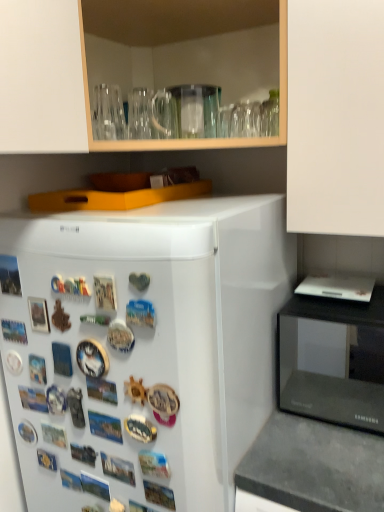
What are the coordinates of `transparent glass cabinet at upper center` in the screenshot? It's located at (73, 83).

The width and height of the screenshot is (384, 512). What do you see at coordinates (142, 349) in the screenshot? I see `white glossy refrigerator at left` at bounding box center [142, 349].

Identify the location of black glossy microwave at right. Image resolution: width=384 pixels, height=512 pixels. (333, 360).

The image size is (384, 512). Find the location of `counter top that appears on the right of transparent glass cabinet at upper center`. counter top that appears on the right of transparent glass cabinet at upper center is located at coordinates (314, 466).

Is dark gray concrete counter top at lower right beside transparent glass cabinet at upper center?

dark gray concrete counter top at lower right and transparent glass cabinet at upper center are not in contact.

Which of these two, dark gray concrete counter top at lower right or transparent glass cabinet at upper center, is thinner?

A: dark gray concrete counter top at lower right is thinner.

From the image's perspective, which is above, dark gray concrete counter top at lower right or transparent glass cabinet at upper center?

transparent glass cabinet at upper center.

How different are the orientations of dark gray concrete counter top at lower right and white glossy refrigerator at left in degrees?

There is a 1.14-degree angle between the facing directions of dark gray concrete counter top at lower right and white glossy refrigerator at left.

How far apart are dark gray concrete counter top at lower right and white glossy refrigerator at left?

dark gray concrete counter top at lower right and white glossy refrigerator at left are 12.49 inches apart.

Looking at this image, which of these two, dark gray concrete counter top at lower right or white glossy refrigerator at left, is bigger?

Bigger between the two is white glossy refrigerator at left.

This screenshot has height=512, width=384. Identify the location of counter top behind the white glossy refrigerator at left. (314, 466).

Is black glossy microwave at right oriented towards dark gray concrete counter top at lower right?

No.

Where is `appliance behind the dark gray concrete counter top at lower right`? This screenshot has width=384, height=512. appliance behind the dark gray concrete counter top at lower right is located at coordinates (333, 360).

Does black glossy microwave at right appear on the left side of dark gray concrete counter top at lower right?

No, black glossy microwave at right is not to the left of dark gray concrete counter top at lower right.

Which object is more forward, black glossy microwave at right or dark gray concrete counter top at lower right?

Positioned in front is dark gray concrete counter top at lower right.

Based on the photo, which point is more distant from viewer, (37, 21) or (186, 405)?

Point (186, 405)

Is transparent glass cabinet at upper center surrounding white glossy refrigerator at left?

No, white glossy refrigerator at left is located outside of transparent glass cabinet at upper center.

Is transparent glass cabinet at upper center next to white glossy refrigerator at left and touching it?

No, transparent glass cabinet at upper center is not touching white glossy refrigerator at left.

Can black glossy microwave at right be found inside dark gray concrete counter top at lower right?

Actually, black glossy microwave at right is outside dark gray concrete counter top at lower right.

Relative to black glossy microwave at right, is dark gray concrete counter top at lower right in front or behind?

In the image, dark gray concrete counter top at lower right appears in front of black glossy microwave at right.

Is dark gray concrete counter top at lower right taller or shorter than black glossy microwave at right?

dark gray concrete counter top at lower right is taller than black glossy microwave at right.

From a real-world perspective, is dark gray concrete counter top at lower right located higher than black glossy microwave at right?

No, from a real-world perspective, dark gray concrete counter top at lower right is not over black glossy microwave at right

Consider the image. Is transparent glass cabinet at upper center behind dark gray concrete counter top at lower right?

Yes, transparent glass cabinet at upper center is behind dark gray concrete counter top at lower right.

From their relative heights in the image, would you say transparent glass cabinet at upper center is taller or shorter than dark gray concrete counter top at lower right?

Considering their sizes, transparent glass cabinet at upper center has less height than dark gray concrete counter top at lower right.

Is transparent glass cabinet at upper center positioned far away from dark gray concrete counter top at lower right?

No.

Which of these two, transparent glass cabinet at upper center or dark gray concrete counter top at lower right, is bigger?

With larger size is transparent glass cabinet at upper center.

Which object is further away from the camera, black glossy microwave at right or white glossy refrigerator at left?

black glossy microwave at right.

Does point (321, 306) appear closer or farther from the camera than point (226, 319)?

Point (321, 306) is positioned farther from the camera compared to point (226, 319).

Locate an element on the screen. The image size is (384, 512). refrigerator located underneath the black glossy microwave at right (from a real-world perspective) is located at coordinates (142, 349).

Which object is positioned more to the right, black glossy microwave at right or white glossy refrigerator at left?

black glossy microwave at right is more to the right.

This screenshot has width=384, height=512. Find the location of `counter top located in front of the transparent glass cabinet at upper center`. counter top located in front of the transparent glass cabinet at upper center is located at coordinates (314, 466).

In the image, there is a white glossy refrigerator at left. Find the location of `counter top below it (from a real-world perspective)`. counter top below it (from a real-world perspective) is located at coordinates (314, 466).

Which object lies nearer to the anchor point black glossy microwave at right, white glossy refrigerator at left or transparent glass cabinet at upper center?

white glossy refrigerator at left.

Looking at the image, which one is located closer to dark gray concrete counter top at lower right, black glossy microwave at right or white glossy refrigerator at left?

white glossy refrigerator at left is closer to dark gray concrete counter top at lower right.

Considering their positions, is dark gray concrete counter top at lower right positioned closer to transparent glass cabinet at upper center than white glossy refrigerator at left?

white glossy refrigerator at left lies closer to transparent glass cabinet at upper center than the other object.

From the image, which object appears to be farther from black glossy microwave at right, white glossy refrigerator at left or dark gray concrete counter top at lower right?

white glossy refrigerator at left lies further to black glossy microwave at right than the other object.

From the image, which object appears to be nearer to dark gray concrete counter top at lower right, white glossy refrigerator at left or transparent glass cabinet at upper center?

white glossy refrigerator at left is positioned closer to the anchor dark gray concrete counter top at lower right.

Estimate the real-world distances between objects in this image. Which object is further from transparent glass cabinet at upper center, white glossy refrigerator at left or dark gray concrete counter top at lower right?

dark gray concrete counter top at lower right lies further to transparent glass cabinet at upper center than the other object.

When comparing their distances from black glossy microwave at right, does transparent glass cabinet at upper center or white glossy refrigerator at left seem closer?

white glossy refrigerator at left is positioned closer to the anchor black glossy microwave at right.

Based on the photo, from the image, which object appears to be farther from transparent glass cabinet at upper center, white glossy refrigerator at left or black glossy microwave at right?

Based on the image, black glossy microwave at right appears to be further to transparent glass cabinet at upper center.

Locate an element on the screen. The image size is (384, 512). appliance that lies between transparent glass cabinet at upper center and dark gray concrete counter top at lower right from top to bottom is located at coordinates (333, 360).

Image resolution: width=384 pixels, height=512 pixels. I want to click on appliance that lies between transparent glass cabinet at upper center and white glossy refrigerator at left from top to bottom, so click(x=333, y=360).

Where is `refrigerator between transparent glass cabinet at upper center and dark gray concrete counter top at lower right in the up-down direction`? The height and width of the screenshot is (512, 384). refrigerator between transparent glass cabinet at upper center and dark gray concrete counter top at lower right in the up-down direction is located at coordinates (142, 349).

Where is `counter top located between white glossy refrigerator at left and black glossy microwave at right in the left-right direction`? This screenshot has width=384, height=512. counter top located between white glossy refrigerator at left and black glossy microwave at right in the left-right direction is located at coordinates (314, 466).